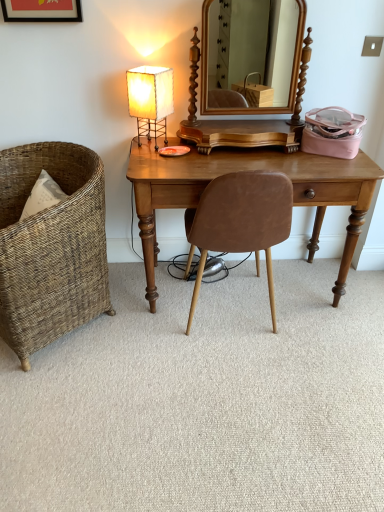
Question: Which is correct: white paper lampshade at upper left is inside wooden mirror at center, or outside of it?

Choices:
 (A) inside
 (B) outside

Answer: (B)

Question: In the image, is white paper lampshade at upper left positioned in front of or behind wooden mirror at center?

Choices:
 (A) front
 (B) behind

Answer: (B)

Question: Which object is the farthest from the carpet at center?

Choices:
 (A) matte black picture frame at upper left
 (B) wooden mirror at center
 (C) light brown wood desk at center
 (D) brown leather chair at center, which is the 1th chair from right to left
 (E) woven wicker chair at left, arranged as the first chair when viewed from the left

Answer: (B)

Question: Estimate the real-world distances between objects in this image. Which object is closer to the brown leather chair at center, placed as the second chair when sorted from left to right?

Choices:
 (A) white paper lampshade at upper left
 (B) matte black picture frame at upper left
 (C) wooden mirror at center
 (D) carpet at center
 (E) light brown wood desk at center

Answer: (E)